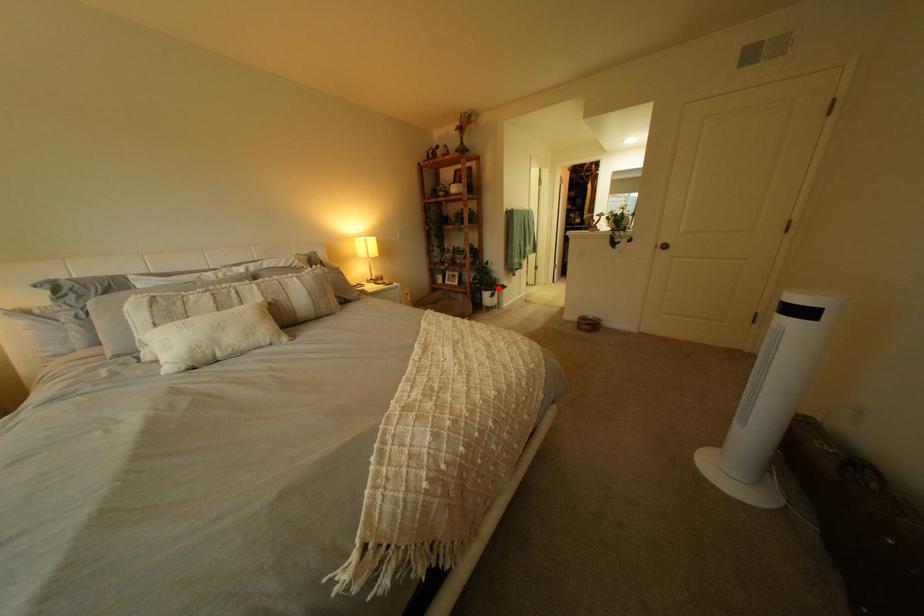
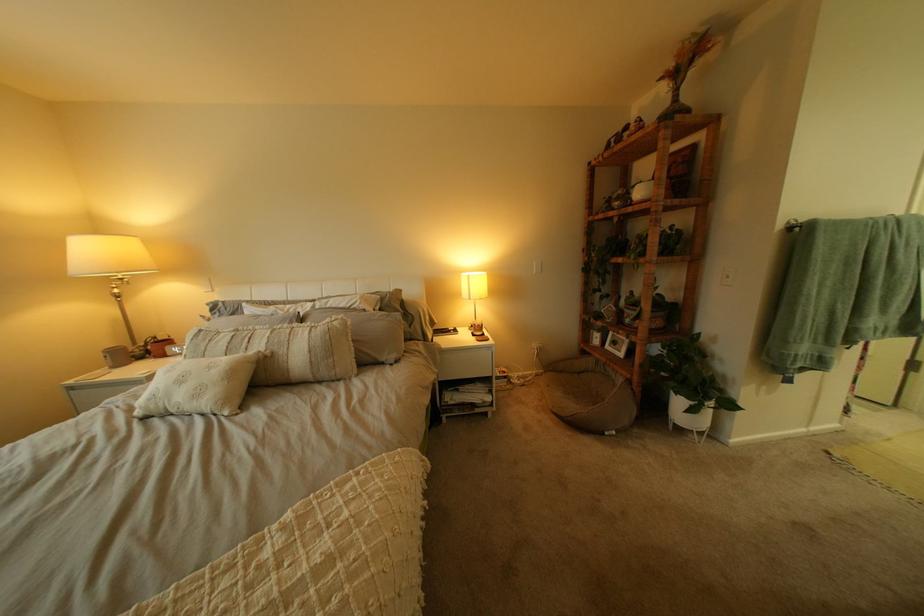
Find the pixel in the second image that matches the highlighted location in the first image.

(687, 385)